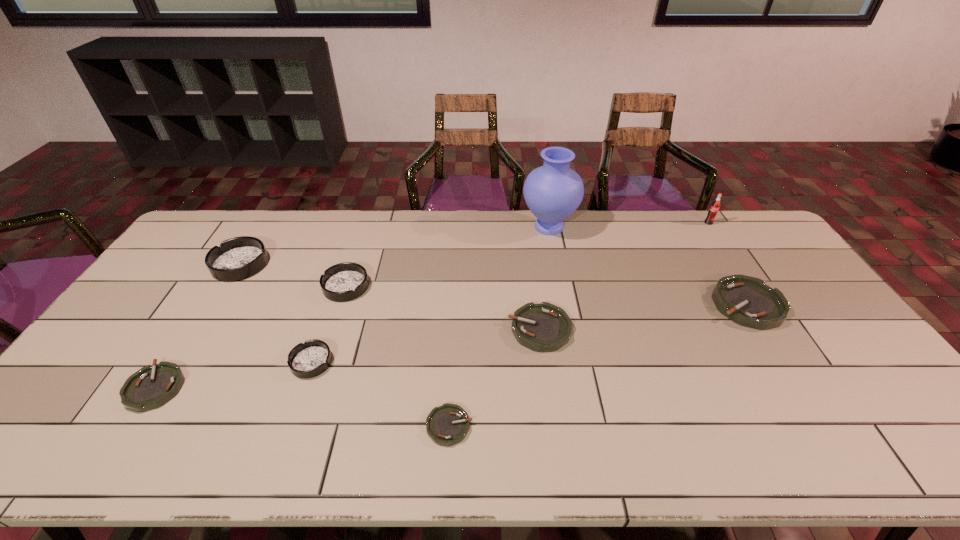
Locate an element on the screen. The width and height of the screenshot is (960, 540). vase is located at coordinates (552, 192).

This screenshot has width=960, height=540. What are the coordinates of `blue vase` in the screenshot? It's located at (552, 192).

I want to click on soda bottle, so click(715, 206).

Where is `the biggest dark ashtray`? The height and width of the screenshot is (540, 960). the biggest dark ashtray is located at coordinates pyautogui.click(x=238, y=258).

Locate an element on the screen. This screenshot has height=540, width=960. the leftmost dark ashtray is located at coordinates (238, 258).

The image size is (960, 540). Identify the location of the second smallest dark ashtray. (343, 282).

The image size is (960, 540). I want to click on the rightmost green ashtray, so click(748, 301).

Identify the location of the biggest green ashtray. The image size is (960, 540). (748, 301).

At what (x,y) coordinates should I click in order to perform the action: click on the second biggest green ashtray. Please return your answer as a coordinate pair (x, y). The width and height of the screenshot is (960, 540). Looking at the image, I should click on (545, 327).

This screenshot has height=540, width=960. Identify the location of the second green ashtray from right to left. (545, 327).